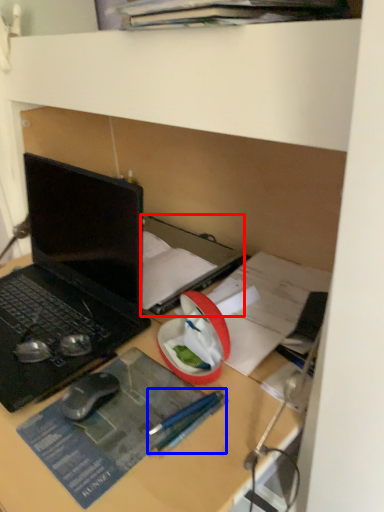
Question: Which of the following is the closest to the observer, book (highlighted by a red box) or pencil (highlighted by a blue box)?

Choices:
 (A) book
 (B) pencil

Answer: (B)